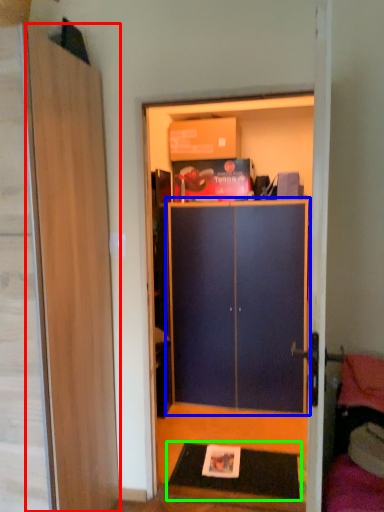
Question: Which object is the farthest from door (highlighted by a red box)? Choose among these: cabinetry (highlighted by a blue box) or doormat (highlighted by a green box).

Choices:
 (A) cabinetry
 (B) doormat

Answer: (A)